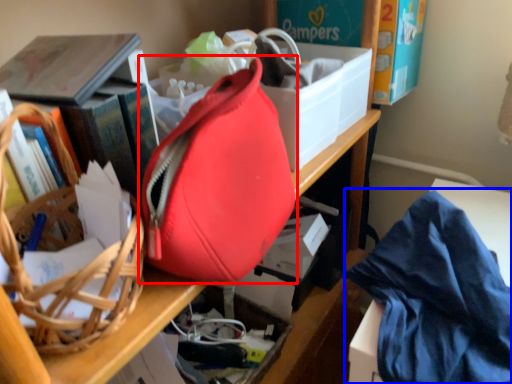
Question: Which object appears farthest to the camera in this image, handbag (highlighted by a red box) or clothe (highlighted by a blue box)?

Choices:
 (A) handbag
 (B) clothe

Answer: (B)